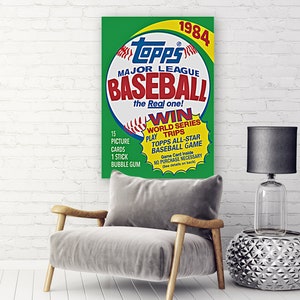
Where is `chair arms`? The height and width of the screenshot is (300, 300). chair arms is located at coordinates (189, 220), (85, 214).